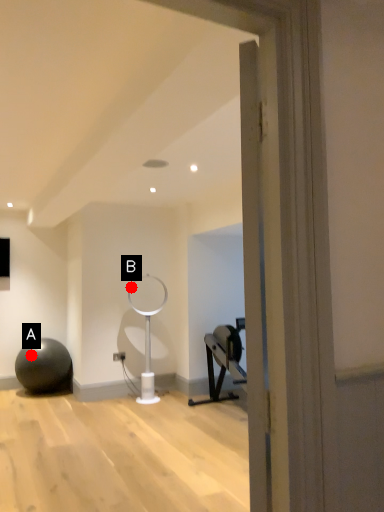
Question: Two points are circled on the image, labeled by A and B beside each circle. Which of the following is the farthest from the observer?

Choices:
 (A) A is further
 (B) B is further

Answer: (B)